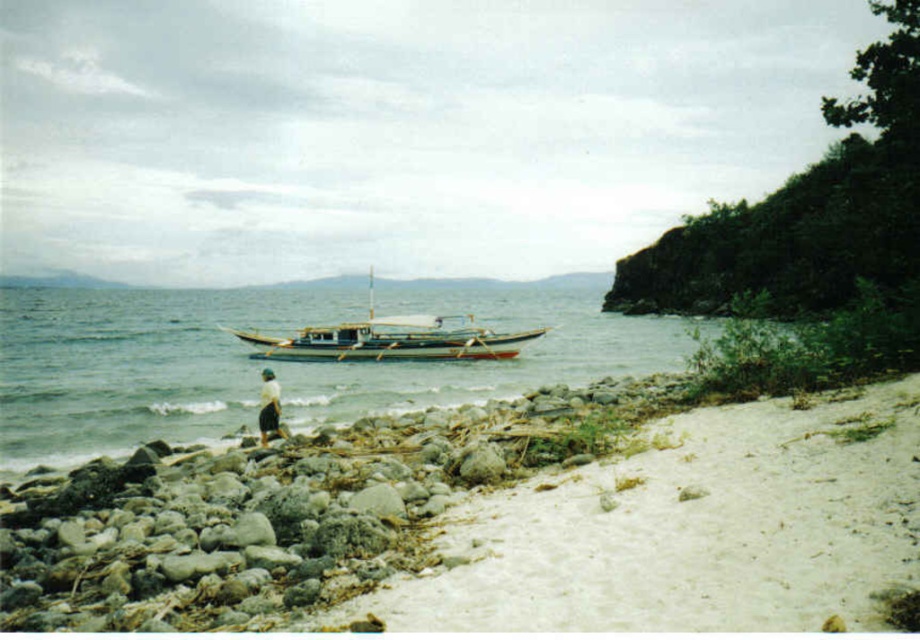
Question: Does white sandy beach at lower right appear on the left side of wooden boat at center?

Choices:
 (A) yes
 (B) no

Answer: (B)

Question: Which of the following is the closest to the observer?

Choices:
 (A) (429, 317)
 (B) (279, 394)
 (C) (838, 410)
 (D) (311, 500)

Answer: (D)

Question: In this image, where is smooth gray rocks at lower left located relative to clear water at boat center?

Choices:
 (A) right
 (B) left

Answer: (A)

Question: Which object appears farthest from the camera in this image?

Choices:
 (A) white fabric skirt at center
 (B) smooth gray rocks at lower left
 (C) wooden boat at center
 (D) white sandy beach at lower right

Answer: (C)

Question: Which point is closer to the camera?

Choices:
 (A) (260, 412)
 (B) (125, 307)
 (C) (560, 556)

Answer: (C)

Question: Considering the relative positions of clear water at boat center and white fabric skirt at center in the image provided, where is clear water at boat center located with respect to white fabric skirt at center?

Choices:
 (A) below
 (B) above

Answer: (B)